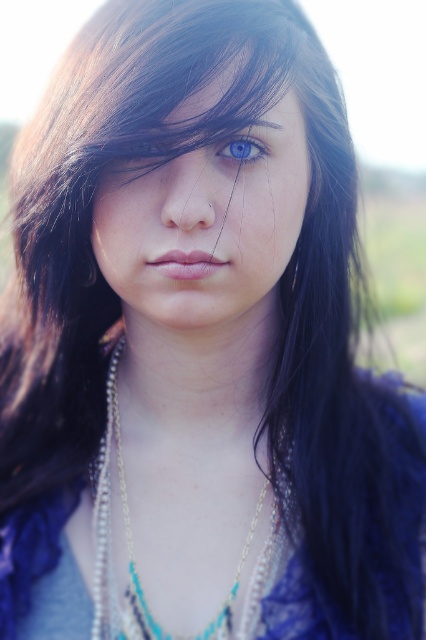
Question: Considering the relative positions of blue fabric dress at center and blue glossy eye at upper center in the image provided, where is blue fabric dress at center located with respect to blue glossy eye at upper center?

Choices:
 (A) right
 (B) left

Answer: (B)

Question: Which object is the closest to the blue matte eye at center?

Choices:
 (A) pearl/beaded necklace at center
 (B) dark brown eyebrow at upper center
 (C) matte black face at center

Answer: (B)

Question: Can you confirm if blue matte eye at center is positioned below blue glossy eye at upper center?

Choices:
 (A) no
 (B) yes

Answer: (B)

Question: Which object is the closest to the dark brown eyebrow at upper center?

Choices:
 (A) blue glossy eye at upper center
 (B) pearl/beaded necklace at center
 (C) blue matte eye at center

Answer: (A)

Question: Can you confirm if matte black face at center is positioned to the right of pearl/beaded necklace at center?

Choices:
 (A) yes
 (B) no

Answer: (A)

Question: Based on their relative distances, which object is nearer to the dark brown eyebrow at upper center?

Choices:
 (A) blue fabric dress at center
 (B) blue matte eye at center
 (C) blue glossy eye at upper center

Answer: (C)